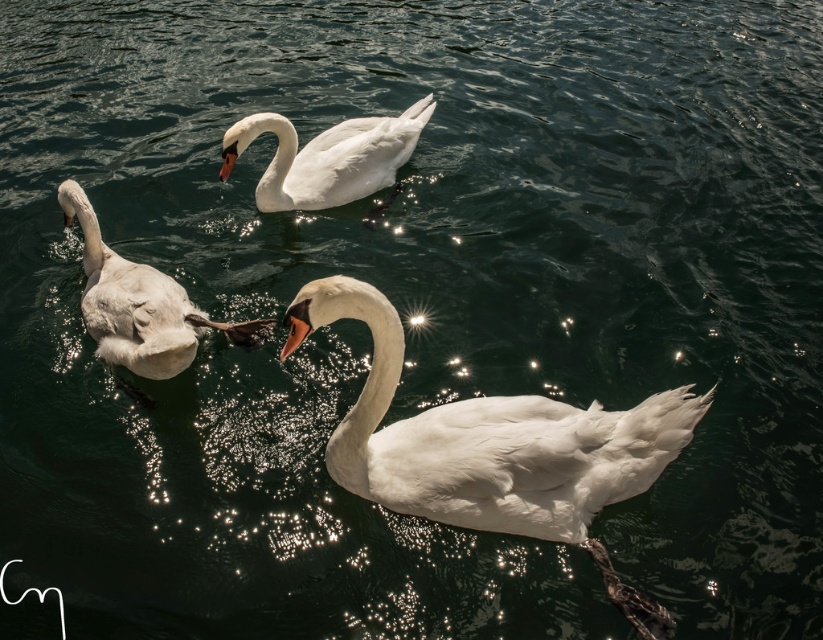
You are a photographer trying to capture the white feathered swan at left. If you are positioned at the center of the image, which direction should you move your camera to focus on the swan?

Since the white feathered swan at left is located at point 0.477 on the x axis and 0.171 on the y axis, the photographer should move the camera to the left and slightly upwards to focus on the swan.

You are observing the swans in the water. Which swan, the white feathered swan at center or the white feathered swan at left, is positioned lower in the image?

The white feathered swan at center is located below the white feathered swan at left, so it is positioned lower in the image.

You are a photographer trying to capture the swans in the image. You want to ensure that the white feathered swan at center and the white feathered swan at left are both in focus. Given that your camera can only focus on one swan at a time, which swan should you focus on to include both in the depth of field?

The white feathered swan at center is larger compared to the white feathered swan at left. Since the larger swan is closer to the camera, focusing on it will also include the smaller, farther swan in the depth of field.